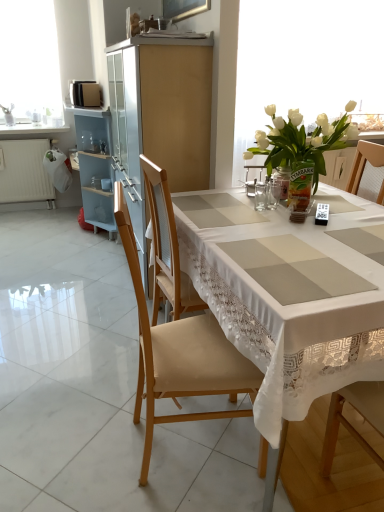
Question: Is the position of white glass vase at upper right less distant than that of clear glass jar at center?

Choices:
 (A) no
 (B) yes

Answer: (A)

Question: Is white glass vase at upper right to the right of clear glass jar at center from the viewer's perspective?

Choices:
 (A) yes
 (B) no

Answer: (A)

Question: From the image's perspective, does white glass vase at upper right appear lower than clear glass jar at center?

Choices:
 (A) no
 (B) yes

Answer: (A)

Question: Is white glass vase at upper right taller than clear glass jar at center?

Choices:
 (A) no
 (B) yes

Answer: (B)

Question: Considering the relative sizes of white glass vase at upper right and clear glass jar at center in the image provided, is white glass vase at upper right smaller than clear glass jar at center?

Choices:
 (A) yes
 (B) no

Answer: (B)

Question: In the image, is translucent glass vase at upper right on the left side or the right side of white glass vase at upper right?

Choices:
 (A) right
 (B) left

Answer: (B)

Question: Is translucent glass vase at upper right in front of or behind white glass vase at upper right in the image?

Choices:
 (A) front
 (B) behind

Answer: (A)

Question: From a real-world perspective, is translucent glass vase at upper right positioned above or below white glass vase at upper right?

Choices:
 (A) below
 (B) above

Answer: (A)

Question: Considering the positions of translucent glass vase at upper right and white glass vase at upper right in the image, is translucent glass vase at upper right bigger or smaller than white glass vase at upper right?

Choices:
 (A) big
 (B) small

Answer: (B)

Question: Would you say clear glass jar at center is inside or outside wooden chair at center, placed as the 2th chair when sorted from front to back?

Choices:
 (A) outside
 (B) inside

Answer: (B)

Question: In terms of height, does clear glass jar at center look taller or shorter compared to wooden chair at center, placed as the 2th chair when sorted from front to back?

Choices:
 (A) short
 (B) tall

Answer: (A)

Question: Is clear glass jar at center to the left or to the right of wooden chair at center, marked as the first chair in a back-to-front arrangement, in the image?

Choices:
 (A) left
 (B) right

Answer: (B)

Question: Considering the positions of point (256, 200) and point (162, 284), is point (256, 200) closer or farther from the camera than point (162, 284)?

Choices:
 (A) farther
 (B) closer

Answer: (B)

Question: Considering the positions of translucent glass vase at upper right and wooden chair at center, marked as the first chair in a back-to-front arrangement, in the image, is translucent glass vase at upper right taller or shorter than wooden chair at center, marked as the first chair in a back-to-front arrangement,?

Choices:
 (A) tall
 (B) short

Answer: (B)

Question: Considering the positions of translucent glass vase at upper right and wooden chair at center, placed as the 2th chair when sorted from front to back, in the image, is translucent glass vase at upper right wider or thinner than wooden chair at center, placed as the 2th chair when sorted from front to back,?

Choices:
 (A) thin
 (B) wide

Answer: (A)